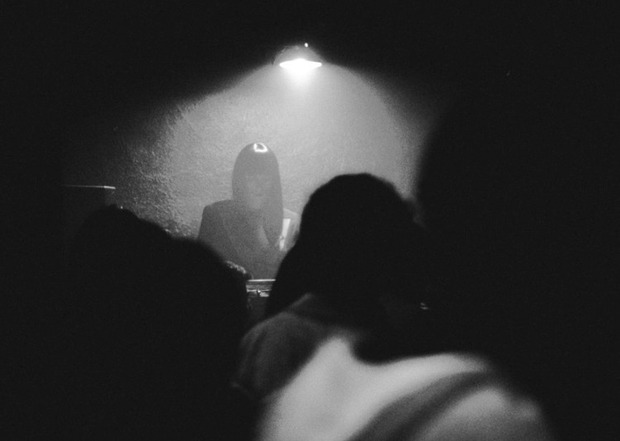
Image resolution: width=620 pixels, height=441 pixels. In order to click on light source in this screenshot , I will do `click(294, 69)`.